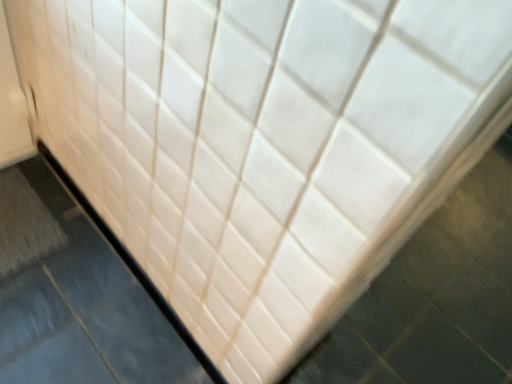
Question: Considering the relative positions of gray textured bath mat at lower left and beige glossy slate at lower left in the image provided, is gray textured bath mat at lower left to the left of beige glossy slate at lower left from the viewer's perspective?

Choices:
 (A) no
 (B) yes

Answer: (B)

Question: Is gray textured bath mat at lower left looking in the opposite direction of beige glossy slate at lower left?

Choices:
 (A) no
 (B) yes

Answer: (A)

Question: Is gray textured bath mat at lower left positioned beyond the bounds of beige glossy slate at lower left?

Choices:
 (A) yes
 (B) no

Answer: (A)

Question: Is gray textured bath mat at lower left facing towards beige glossy slate at lower left?

Choices:
 (A) yes
 (B) no

Answer: (B)

Question: Is there a large distance between gray textured bath mat at lower left and beige glossy slate at lower left?

Choices:
 (A) no
 (B) yes

Answer: (A)

Question: Considering the relative sizes of gray textured bath mat at lower left and beige glossy slate at lower left in the image provided, is gray textured bath mat at lower left taller than beige glossy slate at lower left?

Choices:
 (A) yes
 (B) no

Answer: (B)

Question: Does beige glossy slate at lower left lie behind gray textured bath mat at lower left?

Choices:
 (A) no
 (B) yes

Answer: (A)

Question: Could you tell me if beige glossy slate at lower left is facing gray textured bath mat at lower left?

Choices:
 (A) yes
 (B) no

Answer: (A)

Question: Considering the relative sizes of beige glossy slate at lower left and gray textured bath mat at lower left in the image provided, is beige glossy slate at lower left smaller than gray textured bath mat at lower left?

Choices:
 (A) yes
 (B) no

Answer: (B)

Question: Does beige glossy slate at lower left have a greater height compared to gray textured bath mat at lower left?

Choices:
 (A) yes
 (B) no

Answer: (A)

Question: Are beige glossy slate at lower left and gray textured bath mat at lower left located far from each other?

Choices:
 (A) no
 (B) yes

Answer: (A)

Question: Is gray textured bath mat at lower left a part of beige glossy slate at lower left?

Choices:
 (A) yes
 (B) no

Answer: (B)

Question: Choose the correct answer: Is beige glossy slate at lower left inside gray textured bath mat at lower left or outside it?

Choices:
 (A) outside
 (B) inside

Answer: (A)